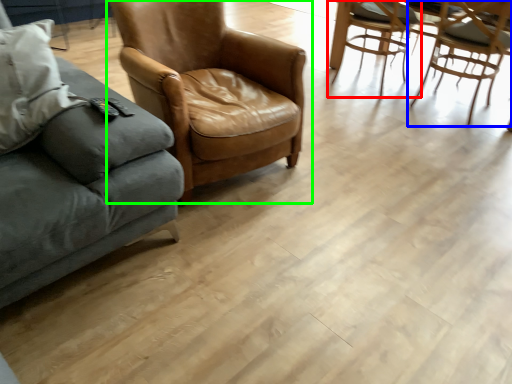
Question: Based on their relative distances, which object is nearer to chair (highlighted by a red box)? Choose from chair (highlighted by a blue box) and chair (highlighted by a green box).

Choices:
 (A) chair
 (B) chair

Answer: (A)